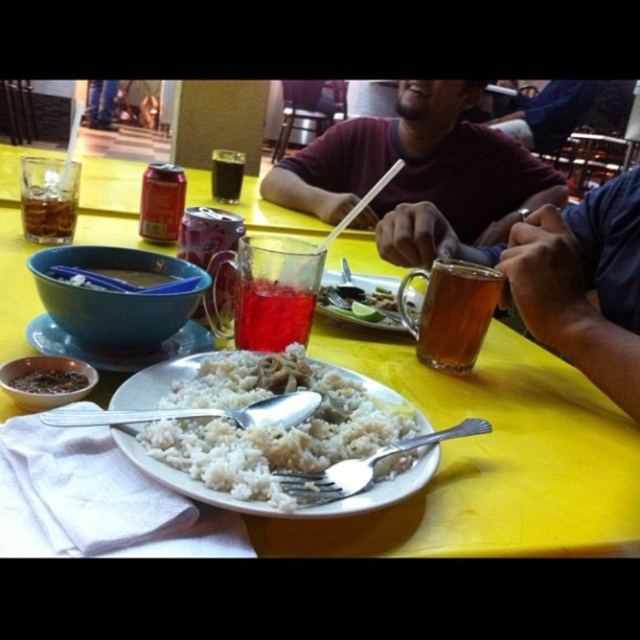
Is white matte rice at center closer to the viewer compared to slightly translucent glass at center?

Yes, it is in front of slightly translucent glass at center.

Where is `white matte rice at center`? Image resolution: width=640 pixels, height=640 pixels. white matte rice at center is located at coordinates (282, 436).

Find the location of `white matte rice at center`. white matte rice at center is located at coordinates (282, 436).

Between slightly translucent glass at center and translucent glass cup at upper left, which one appears on the left side from the viewer's perspective?

translucent glass cup at upper left

Who is higher up, slightly translucent glass at center or translucent glass cup at upper left?

translucent glass cup at upper left is higher up.

Is point (419, 305) farther from camera compared to point (35, 220)?

That is False.

In order to click on slightly translucent glass at center in this screenshot , I will do `click(362, 301)`.

Who is higher up, yellow plastic table at center or translucent glass mug at center?

yellow plastic table at center

Is yellow plastic table at center behind translucent glass mug at center?

No.

Who is more forward, (x=596, y=524) or (x=452, y=314)?

Point (x=596, y=524)

Where is `yellow plastic table at center`? Image resolution: width=640 pixels, height=640 pixels. yellow plastic table at center is located at coordinates (486, 460).